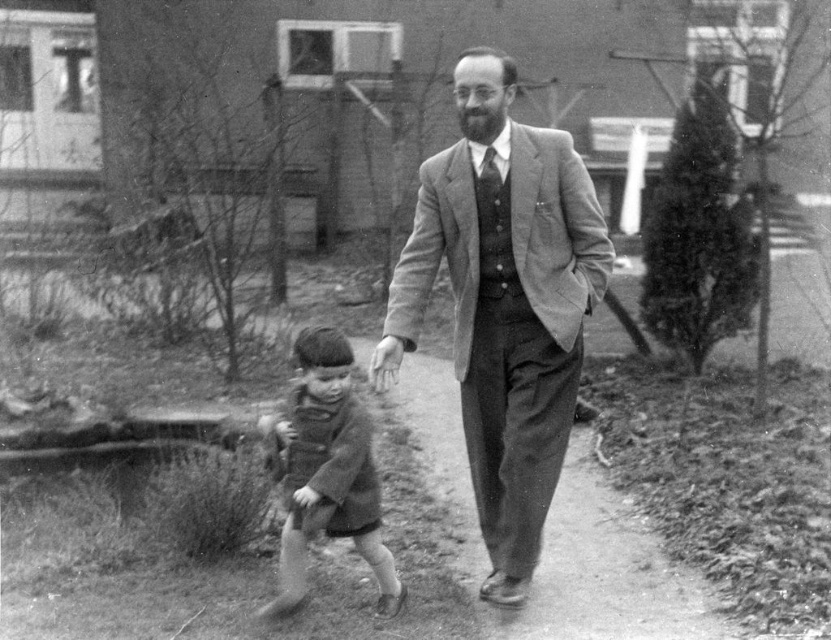
You are a photographer analyzing the image. You notice the smooth woolen suit at center and the dull gray concrete at center. Which object is covering the other?

The smooth woolen suit at center is positioned over the dull gray concrete at center, so it is covering it.

You are standing in the residential area shown in the image. There are two points marked in the scene. The first point is at coordinate point (470, 58) and the second is at point (316, 524). If you want to walk towards the point that is closer to you, which coordinate should you head towards?

You should head towards point (316, 524) because it is closer to you than point (470, 58), which is further away.

Consider the image. You are an observer looking at the scene. The smooth woolen suit at center and the dull gray concrete at center are both in your view. Which object is nearer to you?

The smooth woolen suit at center is closer to the viewer than the dull gray concrete at center.